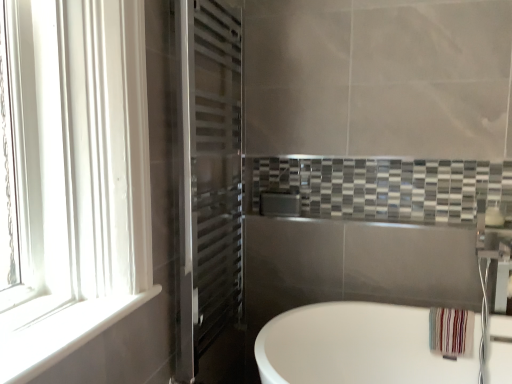
Question: Does white smooth window sill at left appear on the left side of polished stainless steel towel rack at left?

Choices:
 (A) no
 (B) yes

Answer: (B)

Question: Is white smooth window sill at left smaller than polished stainless steel towel rack at left?

Choices:
 (A) yes
 (B) no

Answer: (A)

Question: Could you tell me if white smooth window sill at left is turned towards polished stainless steel towel rack at left?

Choices:
 (A) yes
 (B) no

Answer: (B)

Question: Are white smooth window sill at left and polished stainless steel towel rack at left located far from each other?

Choices:
 (A) yes
 (B) no

Answer: (B)

Question: Is the surface of white smooth window sill at left in direct contact with polished stainless steel towel rack at left?

Choices:
 (A) no
 (B) yes

Answer: (A)

Question: Is point (239, 347) closer or farther from the camera than point (437, 307)?

Choices:
 (A) closer
 (B) farther

Answer: (B)

Question: Would you say polished stainless steel towel rack at left is inside or outside striped fabric towel at lower right?

Choices:
 (A) inside
 (B) outside

Answer: (B)

Question: From a real-world perspective, is polished stainless steel towel rack at left positioned above or below striped fabric towel at lower right?

Choices:
 (A) above
 (B) below

Answer: (A)

Question: Is polished stainless steel towel rack at left wider or thinner than striped fabric towel at lower right?

Choices:
 (A) thin
 (B) wide

Answer: (A)

Question: Is white glossy bathtub at lower right bigger or smaller than striped fabric towel at lower right?

Choices:
 (A) small
 (B) big

Answer: (B)

Question: Would you say white glossy bathtub at lower right is to the left or to the right of striped fabric towel at lower right in the picture?

Choices:
 (A) right
 (B) left

Answer: (B)

Question: Is point (349, 374) closer or farther from the camera than point (449, 324)?

Choices:
 (A) closer
 (B) farther

Answer: (B)

Question: Which is correct: white glossy bathtub at lower right is inside striped fabric towel at lower right, or outside of it?

Choices:
 (A) inside
 (B) outside

Answer: (B)

Question: Would you say polished stainless steel towel rack at left is inside or outside white smooth window sill at left?

Choices:
 (A) inside
 (B) outside

Answer: (B)

Question: From the image's perspective, is polished stainless steel towel rack at left located above or below white smooth window sill at left?

Choices:
 (A) below
 (B) above

Answer: (B)